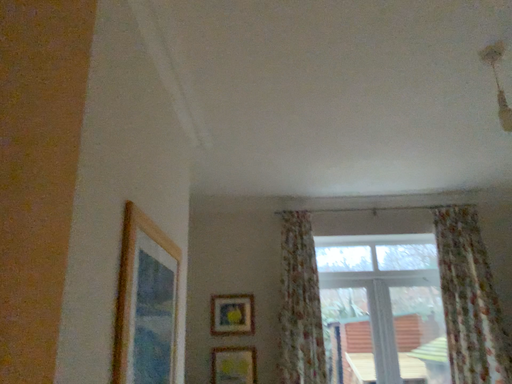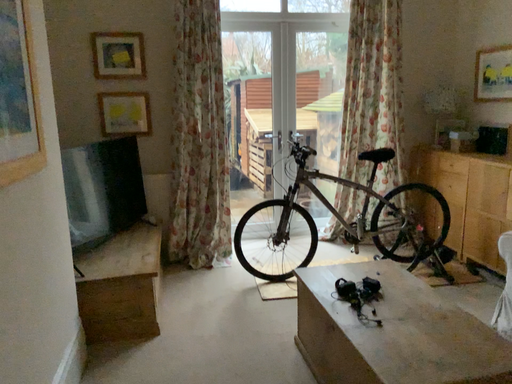
Question: Which way did the camera rotate in the video?

Choices:
 (A) rotated left
 (B) rotated right

Answer: (B)